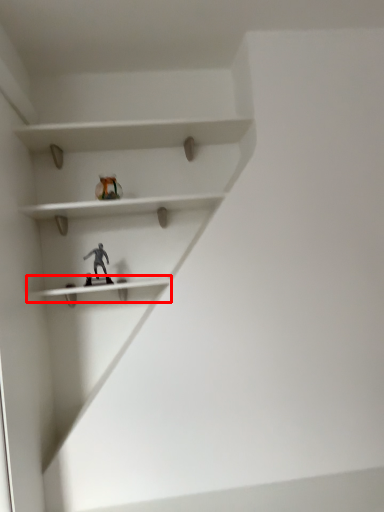
Question: Where is shelf (annotated by the red box) located in relation to toy in the image?

Choices:
 (A) left
 (B) right

Answer: (A)